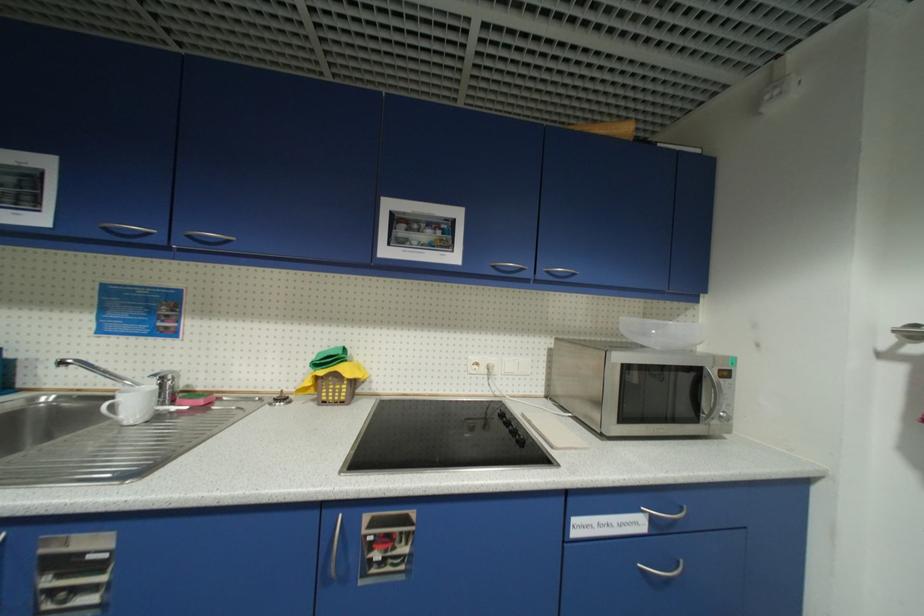
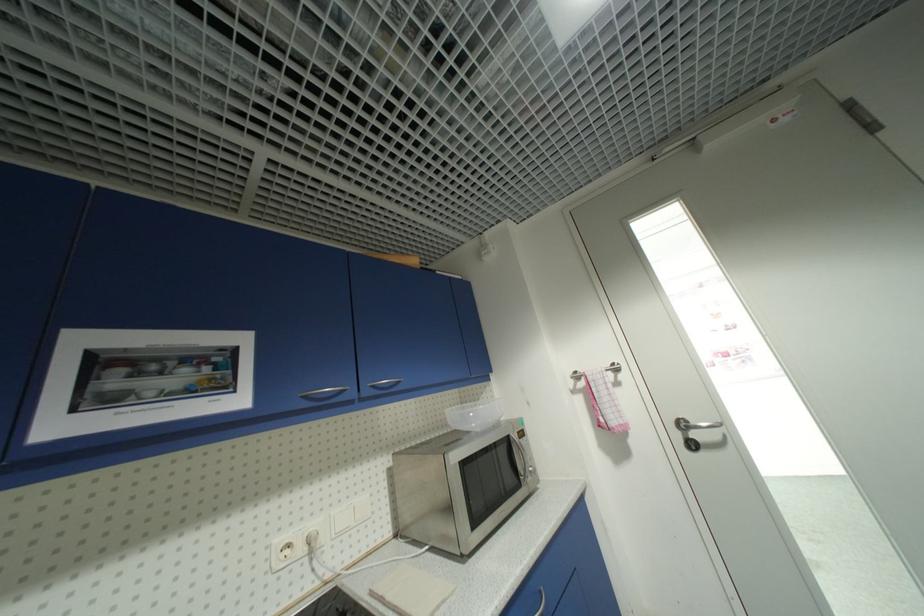
In the second image, find the point that corresponds to point (553, 274) in the first image.

(379, 387)